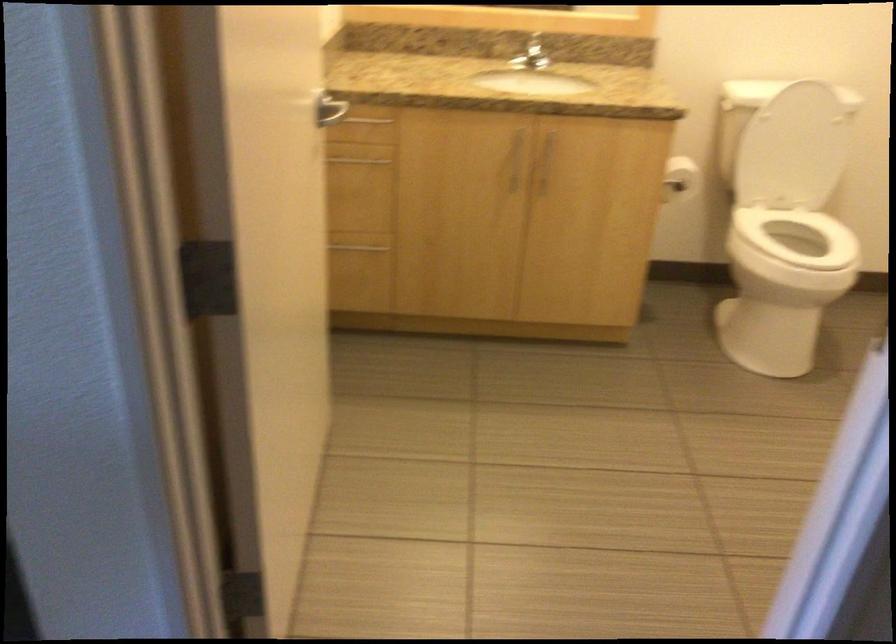
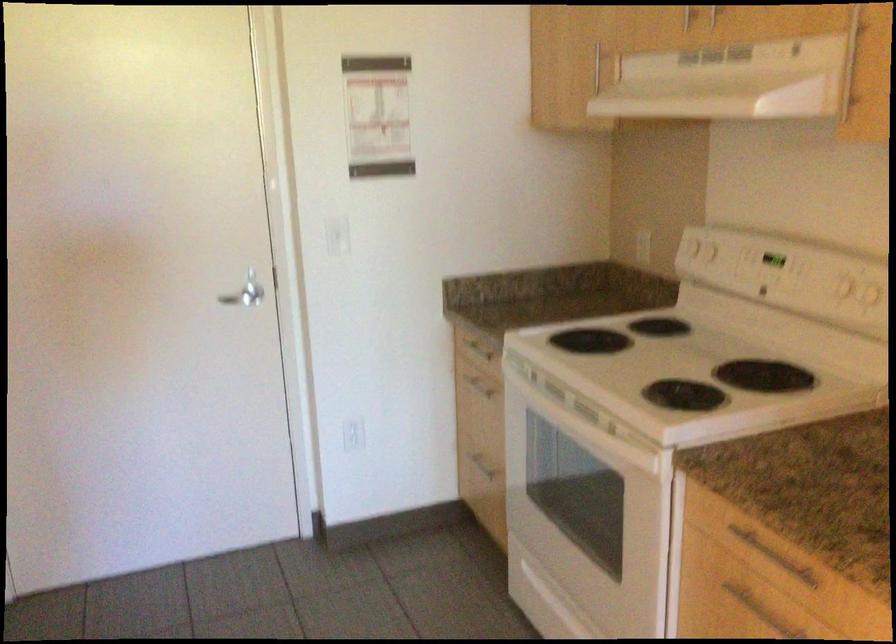
First-person continuous shooting, in which direction is the camera rotating?

The camera rotated toward right-down.